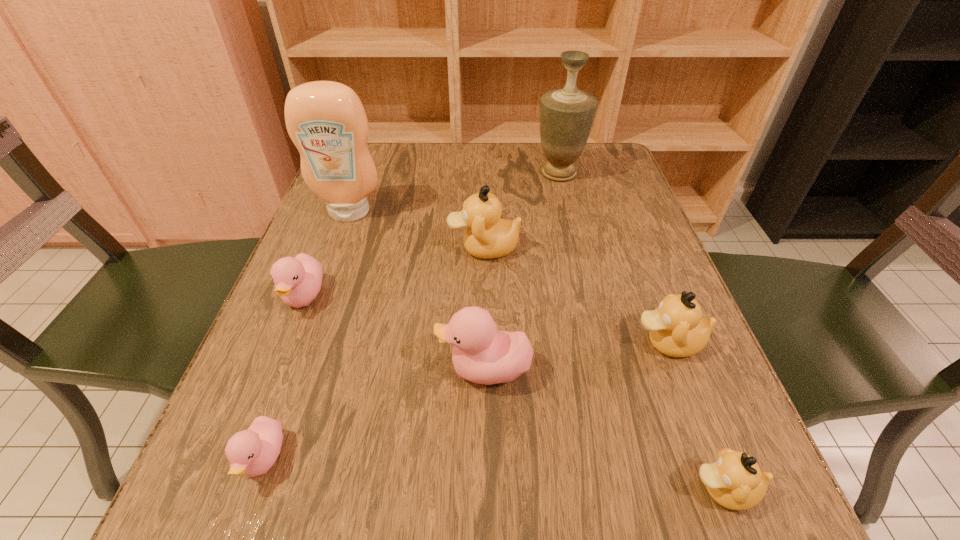
I want to click on the farthest object, so click(566, 115).

This screenshot has height=540, width=960. I want to click on condiment, so click(326, 120).

Image resolution: width=960 pixels, height=540 pixels. In order to click on the biggest tan duckling in this screenshot , I will do `click(487, 236)`.

This screenshot has height=540, width=960. What are the coordinates of `the leftmost tan duckling` in the screenshot? It's located at (487, 236).

Identify the location of the rightmost pink duckling. The image size is (960, 540). (482, 354).

Image resolution: width=960 pixels, height=540 pixels. In order to click on the second nearest pink duckling in this screenshot , I will do `click(482, 354)`.

Identify the location of the second smallest tan duckling. (676, 329).

Where is `the fourth farthest object`? The image size is (960, 540). the fourth farthest object is located at coordinates (298, 280).

Where is `the second smallest pink duckling`? The width and height of the screenshot is (960, 540). the second smallest pink duckling is located at coordinates (298, 280).

Where is `the nearest tan duckling`? the nearest tan duckling is located at coordinates (735, 481).